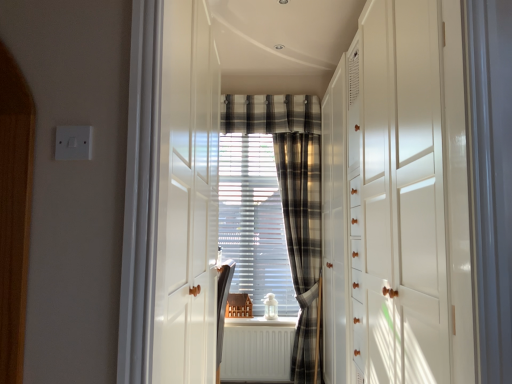
Describe the element at coordinates (270, 114) in the screenshot. I see `plaid fabric at center` at that location.

Find the location of `plaid fabric at center`. plaid fabric at center is located at coordinates (270, 114).

Between white glossy dresser at right and plaid fabric curtain at center, which one has larger width?

white glossy dresser at right.

Based on their positions, is white glossy dresser at right located to the left or right of plaid fabric curtain at center?

white glossy dresser at right is to the right of plaid fabric curtain at center.

Is white glossy dresser at right outside of plaid fabric curtain at center?

white glossy dresser at right is positioned outside plaid fabric curtain at center.

Do you think plaid fabric curtain at center is within plaid fabric at center, or outside of it?

plaid fabric curtain at center is located beyond the bounds of plaid fabric at center.

From the image's perspective, is plaid fabric curtain at center located above or below plaid fabric at center?

Based on their image positions, plaid fabric curtain at center is located beneath plaid fabric at center.

Can you tell me how much plaid fabric curtain at center and plaid fabric at center differ in facing direction?

plaid fabric curtain at center and plaid fabric at center are facing 0.000277 degrees away from each other.

Is plaid fabric curtain at center thinner than plaid fabric at center?

No.

From a real-world perspective, is white matte radiator at center physically above plaid fabric curtain at center?

No, from a real-world perspective, white matte radiator at center is not over plaid fabric curtain at center

Does white matte radiator at center have a greater height compared to plaid fabric curtain at center?

No.

Identify the location of radiator that appears in front of the plaid fabric curtain at center. The image size is (512, 384). (257, 349).

Could you tell me if white matte radiator at center is facing plaid fabric curtain at center?

No, white matte radiator at center is not oriented towards plaid fabric curtain at center.

What's the angular difference between plaid fabric curtain at center and plaid fabric curtain at center's facing directions?

The angle between the facing direction of plaid fabric curtain at center and the facing direction of plaid fabric curtain at center is 0.000175 degrees.

Is plaid fabric curtain at center oriented towards plaid fabric curtain at center?

Yes, plaid fabric curtain at center is turned towards plaid fabric curtain at center.

Which is in front, point (239, 259) or point (320, 345)?

Point (320, 345)

From a real-world perspective, who is located lower, plaid fabric curtain at center or white matte radiator at center?

In real-world perspective, white matte radiator at center is lower.

Which is in front, point (302, 339) or point (228, 362)?

Positioned in front is point (302, 339).

Looking at this image, is white matte radiator at center at the back of plaid fabric curtain at center?

No, plaid fabric curtain at center is not facing the opposite direction of white matte radiator at center.

Between plaid fabric at center and plaid fabric curtain at center, which one has smaller width?

plaid fabric curtain at center.

Is plaid fabric at center spatially inside plaid fabric curtain at center, or outside of it?

plaid fabric at center exists outside the volume of plaid fabric curtain at center.

From the image's perspective, would you say plaid fabric at center is positioned over plaid fabric curtain at center?

Yes, from the image's perspective, plaid fabric at center is on top of plaid fabric curtain at center.

Where is `window screen that appears on the left of plaid fabric at center`? window screen that appears on the left of plaid fabric at center is located at coordinates (254, 221).

Is plaid fabric at center at the back of white matte radiator at center?

No.

In the scene shown: Who is taller, white matte radiator at center or plaid fabric at center?

white matte radiator at center is taller.

Considering the relative positions of white matte radiator at center and plaid fabric at center in the image provided, is white matte radiator at center to the right of plaid fabric at center from the viewer's perspective?

Incorrect, white matte radiator at center is not on the right side of plaid fabric at center.

Is white matte radiator at center further to camera compared to plaid fabric at center?

No, white matte radiator at center is in front of plaid fabric at center.

Locate an element on the screen. The image size is (512, 384). dresser that appears in front of the plaid fabric curtain at center is located at coordinates (404, 198).

Identify the location of plaid lying behind the plaid fabric curtain at center. The width and height of the screenshot is (512, 384). (270, 114).

Looking at the image, which one is located further to plaid fabric at center, white matte radiator at center or white glossy dresser at right?

white matte radiator at center is positioned further to the anchor plaid fabric at center.

Which object lies further to the anchor point plaid fabric at center, plaid fabric curtain at center or white matte radiator at center?

white matte radiator at center is positioned further to the anchor plaid fabric at center.

Considering their positions, is plaid fabric curtain at center positioned closer to plaid fabric at center than white glossy dresser at right?

Based on the image, plaid fabric curtain at center appears to be nearer to plaid fabric at center.

From the image, which object appears to be nearer to white matte radiator at center, plaid fabric curtain at center or plaid fabric at center?

Based on the image, plaid fabric curtain at center appears to be nearer to white matte radiator at center.

Based on their spatial positions, is plaid fabric curtain at center or plaid fabric curtain at center closer to white glossy dresser at right?

The object closer to white glossy dresser at right is plaid fabric curtain at center.

Based on their spatial positions, is white glossy dresser at right or plaid fabric curtain at center further from white matte radiator at center?

The object further to white matte radiator at center is white glossy dresser at right.

Which object lies nearer to the anchor point plaid fabric curtain at center, plaid fabric at center or white glossy dresser at right?

plaid fabric at center is closer to plaid fabric curtain at center.

When comparing their distances from white matte radiator at center, does plaid fabric curtain at center or plaid fabric curtain at center seem further?

Based on the image, plaid fabric curtain at center appears to be further to white matte radiator at center.

Image resolution: width=512 pixels, height=384 pixels. What are the coordinates of `curtain between plaid fabric at center and white matte radiator at center in the up-down direction` in the screenshot? It's located at (302, 242).

The height and width of the screenshot is (384, 512). What are the coordinates of `plaid between white glossy dresser at right and plaid fabric curtain at center along the z-axis` in the screenshot? It's located at (270, 114).

Find the location of a particular element. window screen between plaid fabric at center and white matte radiator at center in the up-down direction is located at coordinates (254, 221).

Where is `window screen between plaid fabric at center and plaid fabric curtain at center vertically`? This screenshot has height=384, width=512. window screen between plaid fabric at center and plaid fabric curtain at center vertically is located at coordinates pos(254,221).